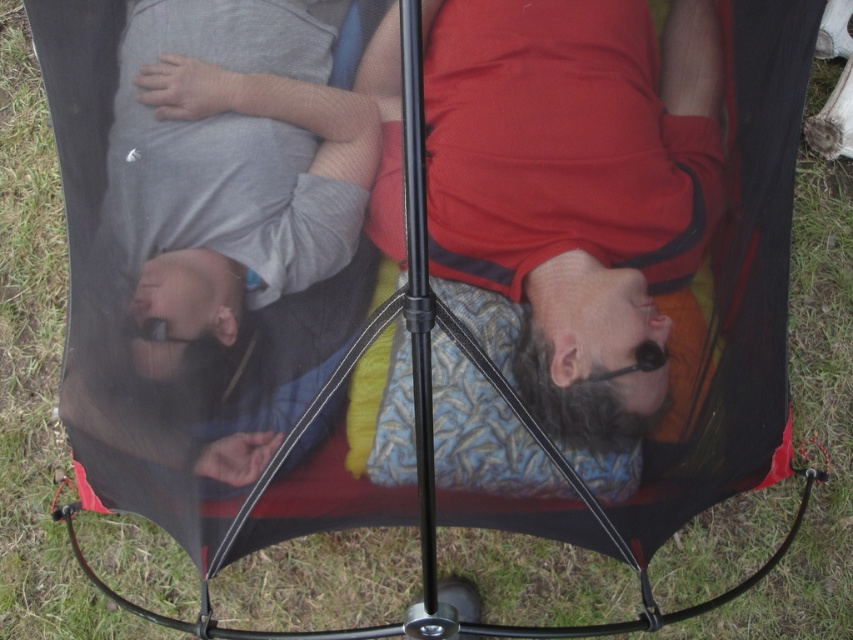
Which of these two, matte red shirt at center or gray cotton shirt at upper left, stands taller?

With more height is matte red shirt at center.

Measure the distance between matte red shirt at center and gray cotton shirt at upper left.

matte red shirt at center is 12.43 inches from gray cotton shirt at upper left.

This screenshot has height=640, width=853. Describe the element at coordinates (575, 186) in the screenshot. I see `matte red shirt at center` at that location.

Where is `matte red shirt at center`? The image size is (853, 640). matte red shirt at center is located at coordinates (575, 186).